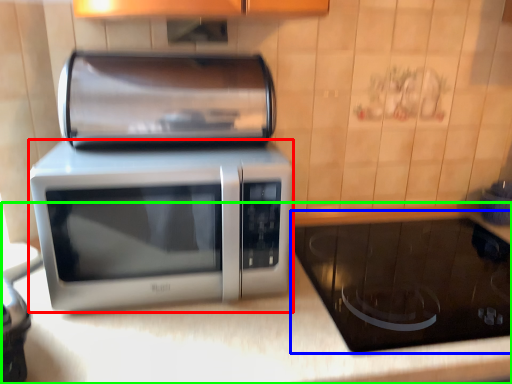
Question: Estimate the real-world distances between objects in this image. Which object is closer to microwave oven (highlighted by a red box), appliance (highlighted by a blue box) or counter top (highlighted by a green box)?

Choices:
 (A) appliance
 (B) counter top

Answer: (B)